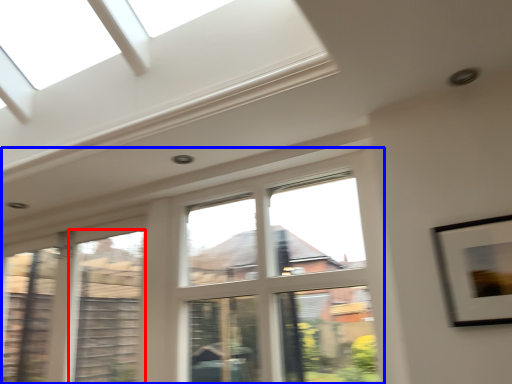
Question: Which object is closer to the camera taking this photo, window (highlighted by a red box) or window (highlighted by a blue box)?

Choices:
 (A) window
 (B) window

Answer: (B)